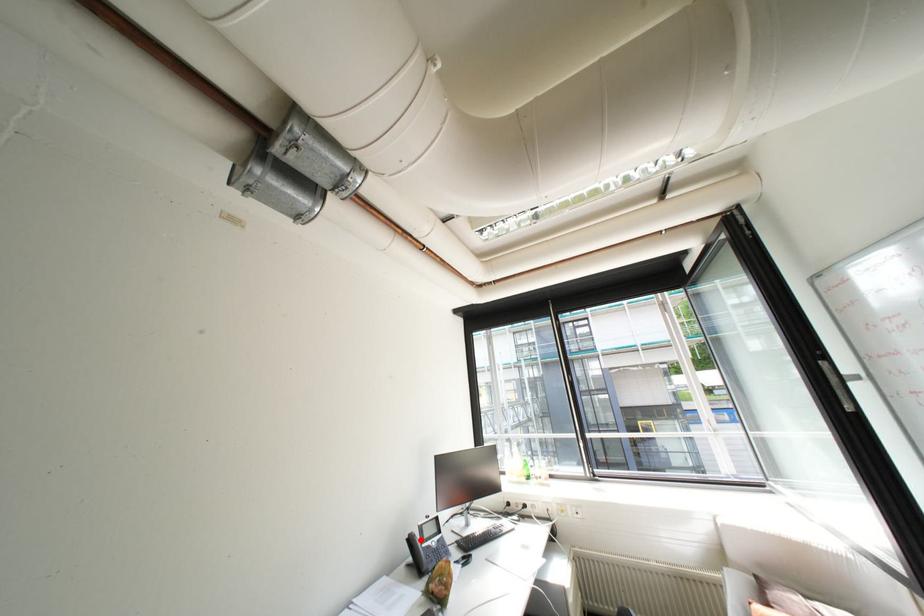
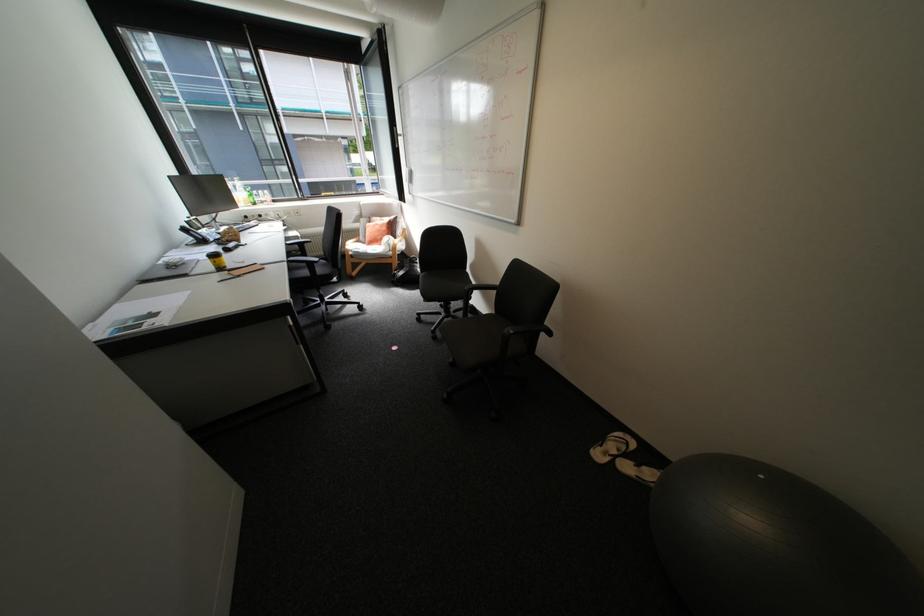
Where in the second image is the point corresponding to the highlighted location from the first image?

(195, 230)